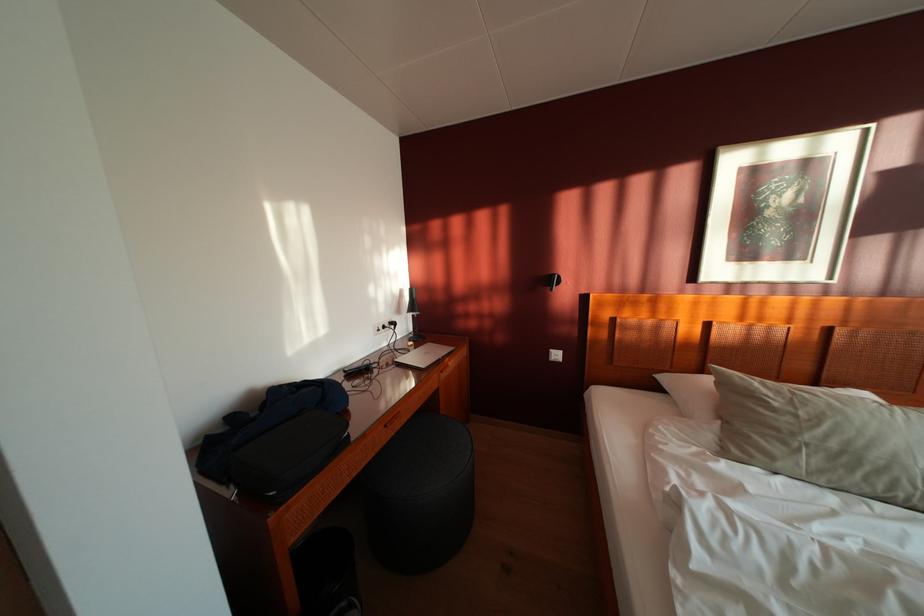
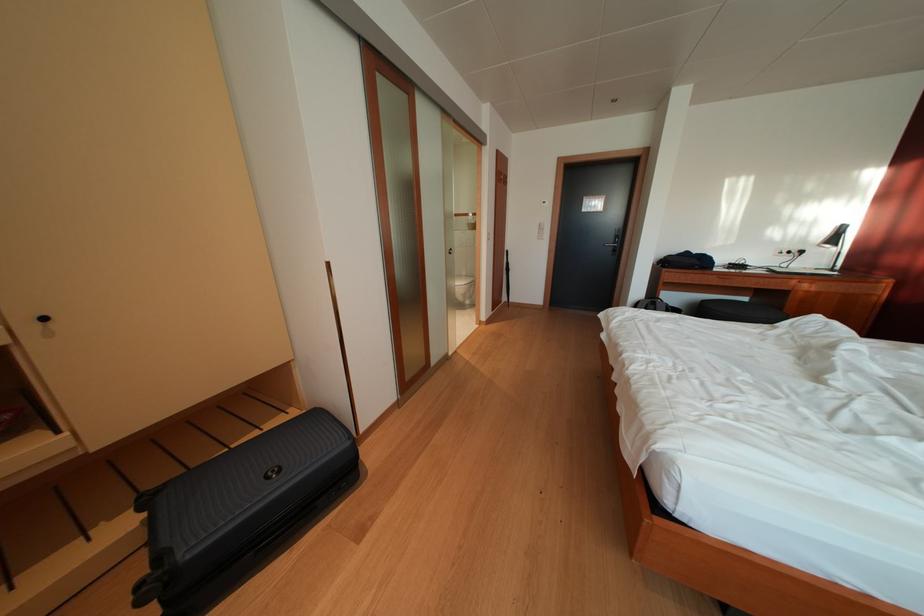
Where in the second image is the point corresponding to (402,330) from the first image?

(809, 257)